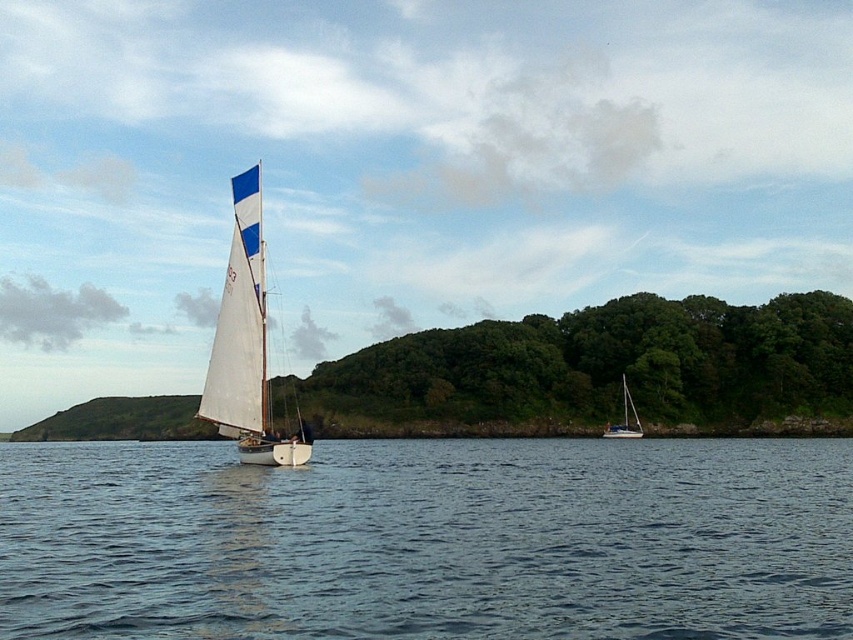
Is blue water at center in front of white glossy sailboat at center?

Yes, it is.

Which is below, blue water at center or white glossy sailboat at center?

white glossy sailboat at center is below.

Between point (775, 563) and point (630, 426), which one is positioned behind?

The point (630, 426) is behind.

I want to click on blue water at center, so click(x=428, y=540).

Between white sail at left and white glossy sailboat at center, which one appears on the right side from the viewer's perspective?

white glossy sailboat at center

In the scene shown: Who is more distant from viewer, (207, 380) or (625, 387)?

The point (625, 387) is behind.

Image resolution: width=853 pixels, height=640 pixels. I want to click on white sail at left, so click(x=247, y=342).

Is blue water at center behind white sail at left?

No, it is not.

Between blue water at center and white sail at left, which one has less height?

blue water at center

Where is `blue water at center`? blue water at center is located at coordinates (428, 540).